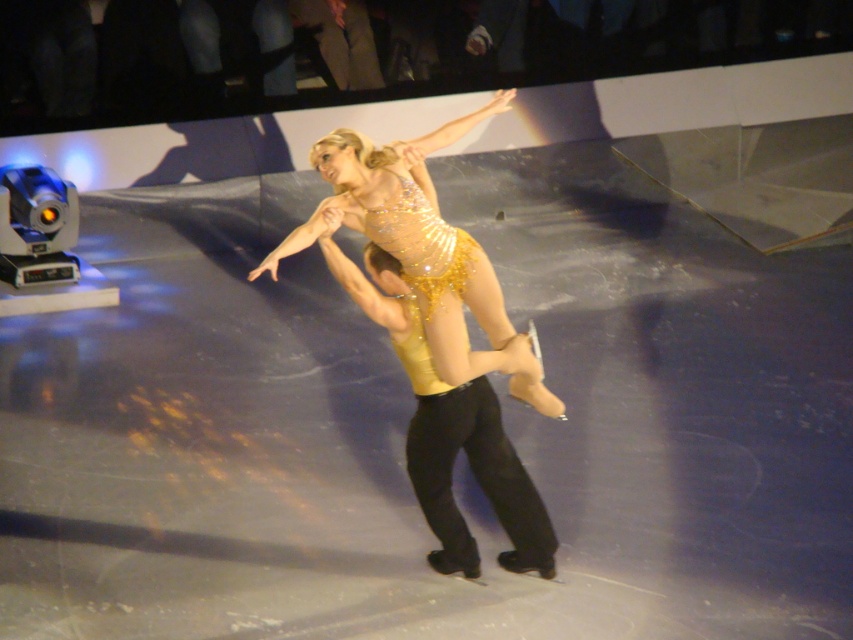
Question: Which of the following is the closest to the observer?

Choices:
 (A) (492, 346)
 (B) (419, 362)

Answer: (B)

Question: Can you confirm if gold shiny pants at center is positioned to the right of sparkly gold dress at center?

Choices:
 (A) no
 (B) yes

Answer: (A)

Question: Which object appears farthest from the camera in this image?

Choices:
 (A) sparkly gold dress at center
 (B) gold shiny pants at center

Answer: (B)

Question: Is gold shiny pants at center to the right of sparkly gold dress at center from the viewer's perspective?

Choices:
 (A) no
 (B) yes

Answer: (A)

Question: Is gold shiny pants at center bigger than sparkly gold dress at center?

Choices:
 (A) no
 (B) yes

Answer: (A)